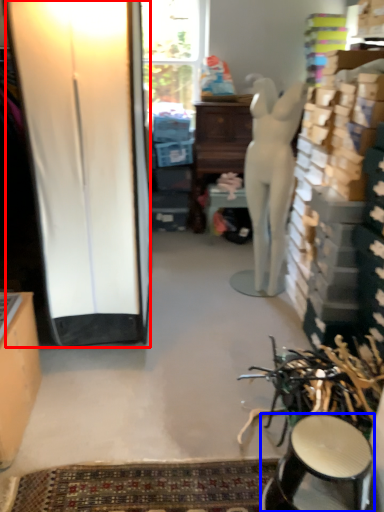
Question: Which object is closer to the camera taking this photo, screen door (highlighted by a red box) or stool (highlighted by a blue box)?

Choices:
 (A) screen door
 (B) stool

Answer: (B)